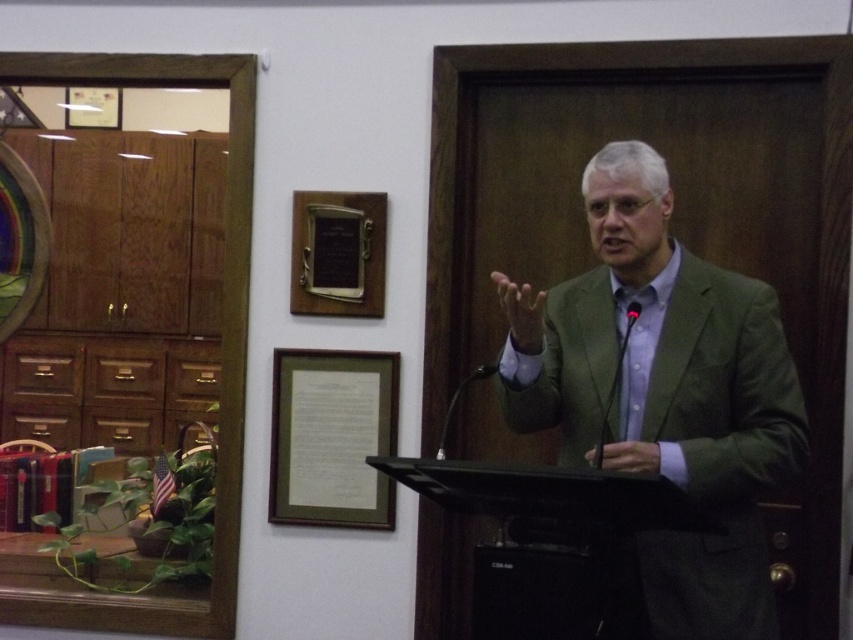
Does green fabric suit at center have a greater width compared to wooden plaque at upper center?

Correct, the width of green fabric suit at center exceeds that of wooden plaque at upper center.

Measure the distance from green fabric suit at center to wooden plaque at upper center.

green fabric suit at center is 87.69 centimeters from wooden plaque at upper center.

Find the location of `green fabric suit at center`. green fabric suit at center is located at coordinates (663, 397).

Who is more forward, (358,368) or (334,221)?

Point (358,368)

Is green matte picture frame at center wider than wooden plaque at upper center?

Correct, the width of green matte picture frame at center exceeds that of wooden plaque at upper center.

Does point (347, 499) lie in front of point (303, 220)?

That is True.

At what (x,y) coordinates should I click in order to perform the action: click on green matte picture frame at center. Please return your answer as a coordinate pair (x, y). Looking at the image, I should click on (332, 436).

Does green fabric suit at center appear under green matte picture frame at center?

No.

Who is positioned more to the right, green fabric suit at center or green matte picture frame at center?

green fabric suit at center is more to the right.

You are a GUI agent. You are given a task and a screenshot of the screen. Output one action in this format:
    pyautogui.click(x=<x>, y=<y>)
    Task: Click on the green fabric suit at center
    The width and height of the screenshot is (853, 640).
    Given the screenshot: What is the action you would take?
    pyautogui.click(x=663, y=397)